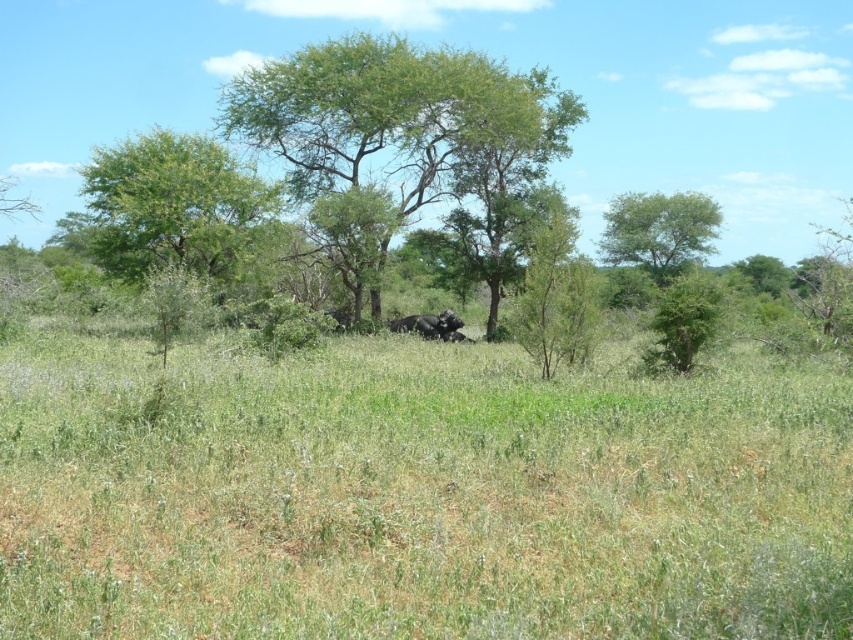
You are an animal in the savanna looking for shade. You see the green leafy tree at upper left and the green leafy tree at upper right. Which tree is closer to your left side?

The green leafy tree at upper left is to the left of the green leafy tree at upper right, so it is closer to your left side.

You are a small animal that needs to cross the savanna between the two points marked as point (575, 595). The distance between them is 16.57 feet. Can you make the journey if your maximum travel distance is 15 feet?

The distance between the two points is 16.57 feet, which exceeds your maximum travel distance of 15 feet. Therefore, you cannot make the journey between point (575, 595).